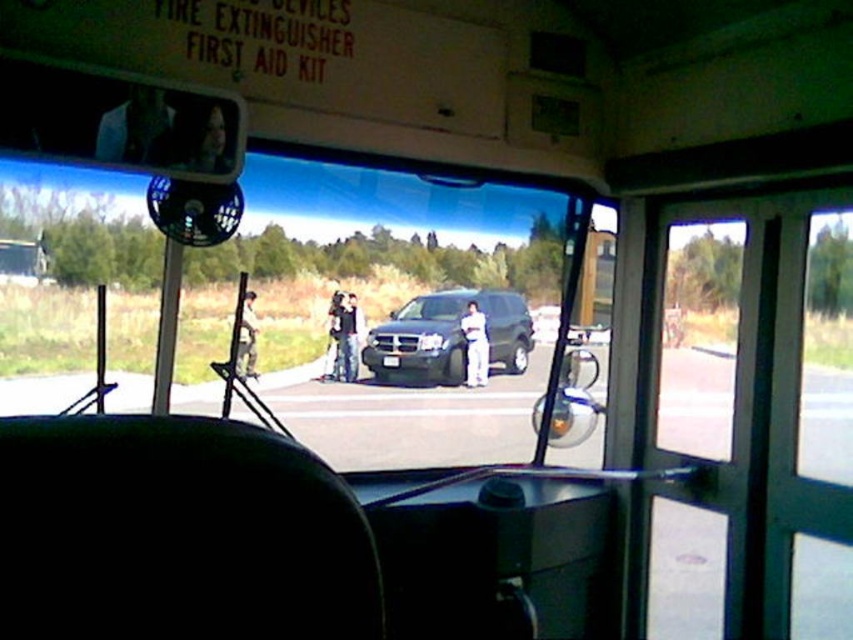
Looking at this image, you are a passenger sitting in the middle seat of the vehicle. You notice two people standing outside near the parked SUV. Both are wearing pants at the center of their bodies. The person wearing white cotton pants at center and the other wearing denim pants at center. Which pair of pants appears wider?

The white cotton pants at center appears wider than the denim pants at center because the white cotton pants at center has a larger width according to the description.

You are a passenger in the vehicle and notice the metallic dark green suv at center and the camouflage fabric jacket at center outside the window. Which object takes up more space in your view?

The metallic dark green suv at center is bigger than the camouflage fabric jacket at center, so the metallic dark green suv at center takes up more space in the view.